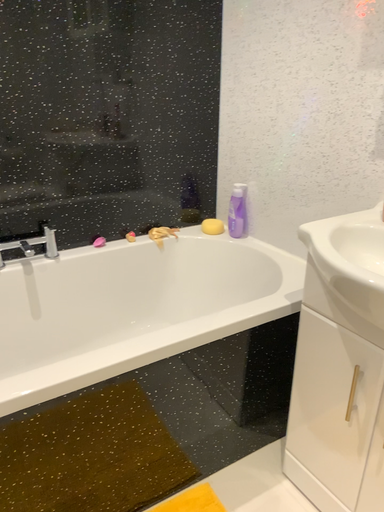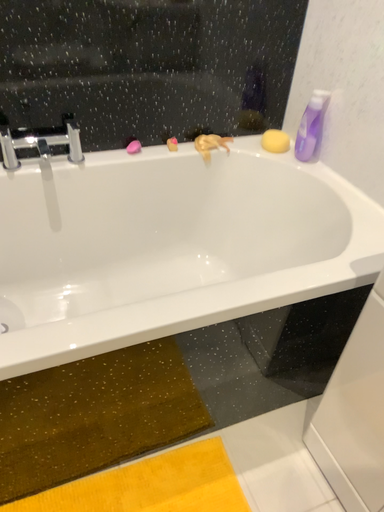
Question: Which way did the camera rotate in the video?

Choices:
 (A) rotated right
 (B) rotated left

Answer: (B)